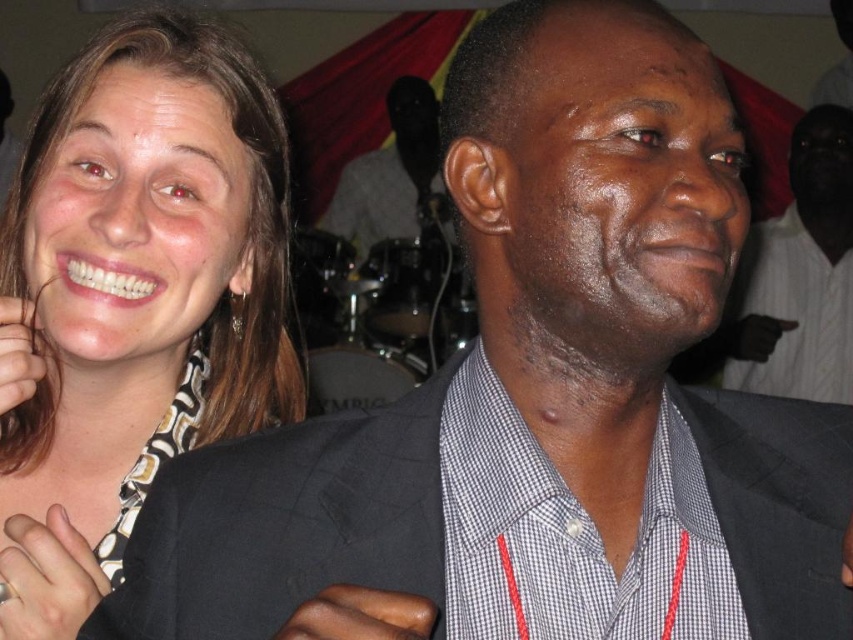
Question: Estimate the real-world distances between objects in this image. Which object is closer to the brown skin hand at center?

Choices:
 (A) smooth skin hand at lower left
 (B) matte black suit at center

Answer: (A)

Question: Estimate the real-world distances between objects in this image. Which object is closer to the light brown leather hand at lower left?

Choices:
 (A) smooth skin hand at lower left
 (B) matte black suit at center
 (C) matte black suit at left

Answer: (A)

Question: Is smooth skin hand at lower left further to camera compared to dark gray fabric at right?

Choices:
 (A) no
 (B) yes

Answer: (A)

Question: From the image, what is the correct spatial relationship of light brown leather hand at lower left in relation to dark gray fabric at right?

Choices:
 (A) left
 (B) right

Answer: (A)

Question: Which object is positioned closest to the matte black suit at left?

Choices:
 (A) matte black suit at center
 (B) light brown leather hand at lower left
 (C) smooth skin hand at lower left

Answer: (C)

Question: Does matte black suit at center have a greater width compared to smooth skin hand at lower left?

Choices:
 (A) yes
 (B) no

Answer: (A)